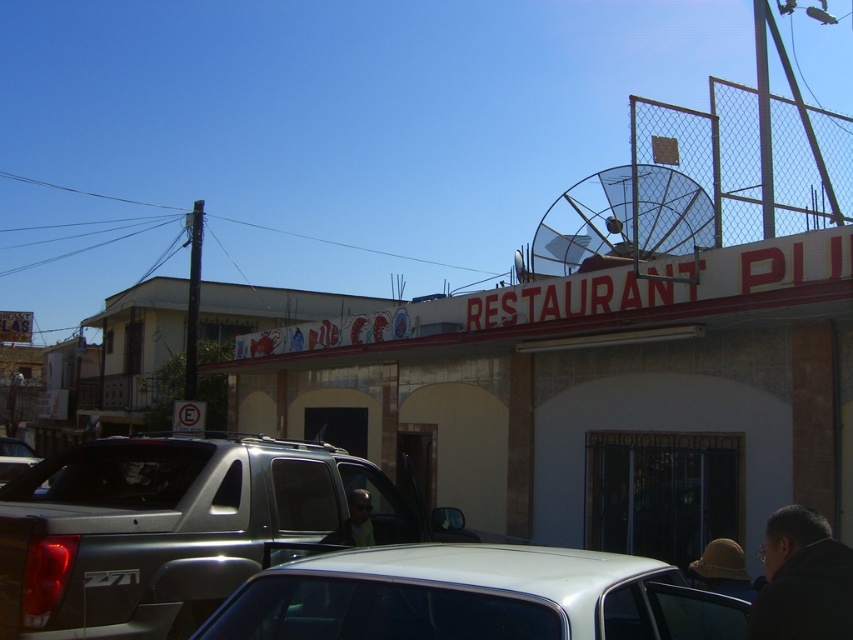
Question: Does brown felt hat at lower right have a lesser width compared to matte yellow shirt at center?

Choices:
 (A) yes
 (B) no

Answer: (A)

Question: Which object is closer to the camera taking this photo?

Choices:
 (A) white glossy car at lower center
 (B) silver metallic truck at center
 (C) brown felt hat at lower right
 (D) silver metallic truck at lower left

Answer: (A)

Question: Which of the following is the farthest from the observer?

Choices:
 (A) (247, 452)
 (B) (18, 467)

Answer: (B)

Question: Which object is closer to the camera taking this photo?

Choices:
 (A) matte yellow shirt at center
 (B) white glossy car at lower center

Answer: (B)

Question: In this image, where is white glossy car at lower center located relative to silver metallic truck at lower left?

Choices:
 (A) above
 (B) below

Answer: (A)

Question: Is dark gray jacket at lower right smaller than silver metallic truck at lower left?

Choices:
 (A) yes
 (B) no

Answer: (A)